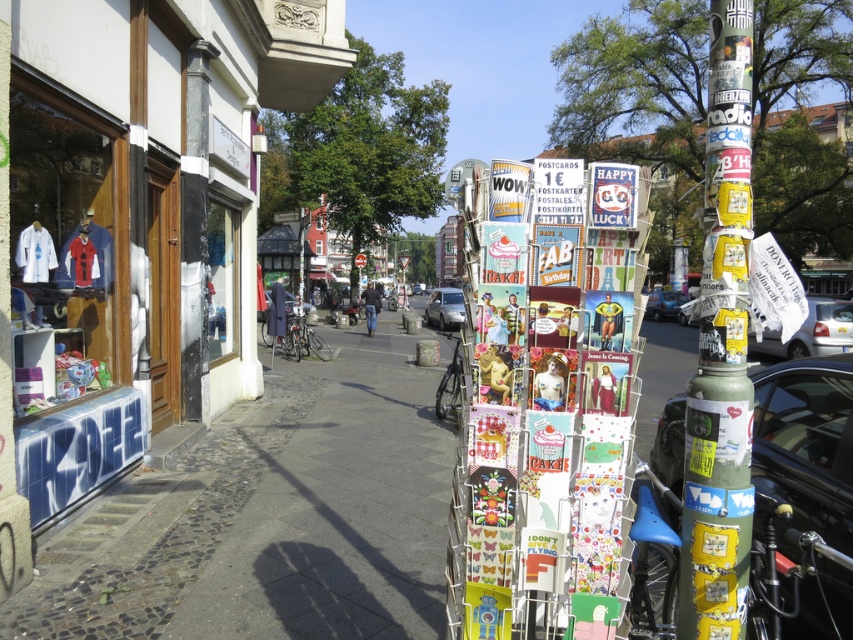
You are a pedestrian standing in the middle of the street. You want to walk to the green textured pole at right and the white glossy car at right. Which one is closer to you?

The green textured pole at right is closer to you because it is in front of the white glossy car at right.

You are a delivery person who needs to place a large box between the green textured pole at right and the white glossy car at right. The box requires 8 meters of space. Is there enough space between them?

The green textured pole at right and the white glossy car at right are 7.46 meters apart from each other, so there is not enough space to place the box requiring 8 meters of space between them.